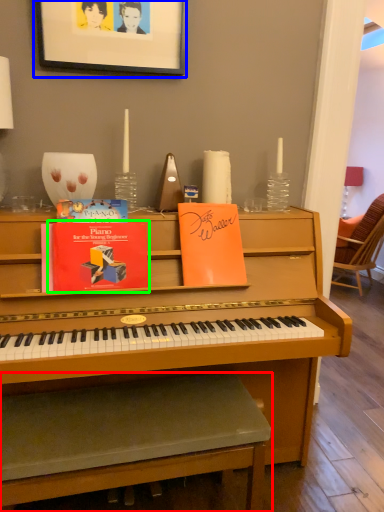
Question: Based on their relative distances, which object is farther from music stool (highlighted by a red box)? Choose from picture frame (highlighted by a blue box) and paperback book (highlighted by a green box).

Choices:
 (A) picture frame
 (B) paperback book

Answer: (A)